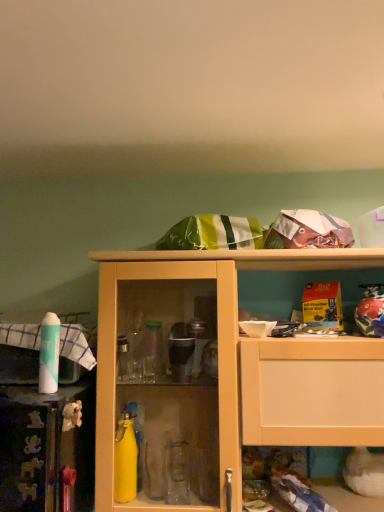
Question: Considering the relative positions of matte yellow cabinet at center and white matte spray can at left in the image provided, is matte yellow cabinet at center to the left or to the right of white matte spray can at left?

Choices:
 (A) left
 (B) right

Answer: (B)

Question: From the image's perspective, is matte yellow cabinet at center above or below white matte spray can at left?

Choices:
 (A) above
 (B) below

Answer: (B)

Question: Would you say matte yellow cabinet at center is inside or outside white matte spray can at left?

Choices:
 (A) outside
 (B) inside

Answer: (A)

Question: Based on their positions, is white matte spray can at left located to the left or right of matte yellow cabinet at center?

Choices:
 (A) right
 (B) left

Answer: (B)

Question: From their relative heights in the image, would you say white matte spray can at left is taller or shorter than matte yellow cabinet at center?

Choices:
 (A) short
 (B) tall

Answer: (A)

Question: From a real-world perspective, is white matte spray can at left positioned above or below matte yellow cabinet at center?

Choices:
 (A) below
 (B) above

Answer: (B)

Question: From the image's perspective, is white matte spray can at left located above or below matte yellow cabinet at center?

Choices:
 (A) below
 (B) above

Answer: (B)